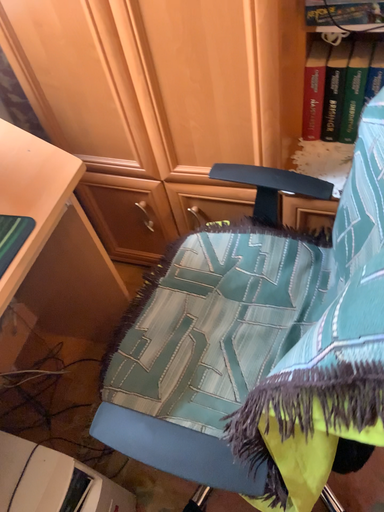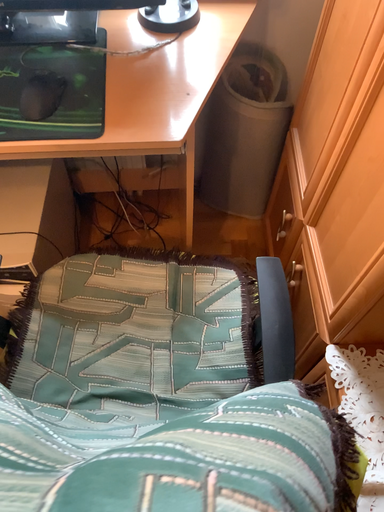
Question: How did the camera likely rotate when shooting the video?

Choices:
 (A) rotated right
 (B) rotated left

Answer: (B)